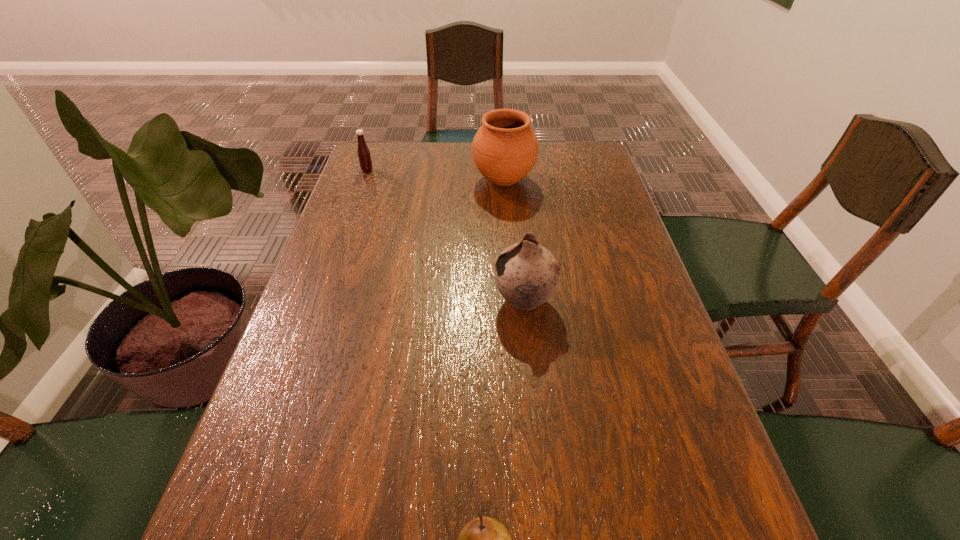
I want to click on Tabasco sauce at the far edge, so click(x=363, y=152).

Image resolution: width=960 pixels, height=540 pixels. In order to click on object located at the left edge in this screenshot , I will do `click(363, 152)`.

The image size is (960, 540). Identify the location of object at the far left corner. (363, 152).

Where is `vacant region at the far edge`? The width and height of the screenshot is (960, 540). vacant region at the far edge is located at coordinates click(454, 177).

The width and height of the screenshot is (960, 540). Find the location of `vacant area at the left edge of the desktop`. vacant area at the left edge of the desktop is located at coordinates point(363,336).

Locate an element on the screen. vacant space at the right edge is located at coordinates (596, 297).

The width and height of the screenshot is (960, 540). What are the coordinates of `free point at the far left corner` in the screenshot? It's located at (396, 167).

You are a GUI agent. You are given a task and a screenshot of the screen. Output one action in this format:
    pyautogui.click(x=<x>, y=<y>)
    Task: Click on the vacant space at the far right corner of the desktop
    This screenshot has width=960, height=540.
    Given the screenshot: What is the action you would take?
    pyautogui.click(x=594, y=174)

Identify the location of free space that is in between the farther pottery and the third farthest object. Image resolution: width=960 pixels, height=540 pixels. pyautogui.click(x=514, y=240).

You are a GUI agent. You are given a task and a screenshot of the screen. Output one action in this format:
    pyautogui.click(x=<x>, y=<y>)
    Task: Click on the free space between the second nearest object and the farther pottery
    The height and width of the screenshot is (540, 960).
    Given the screenshot: What is the action you would take?
    pyautogui.click(x=514, y=240)